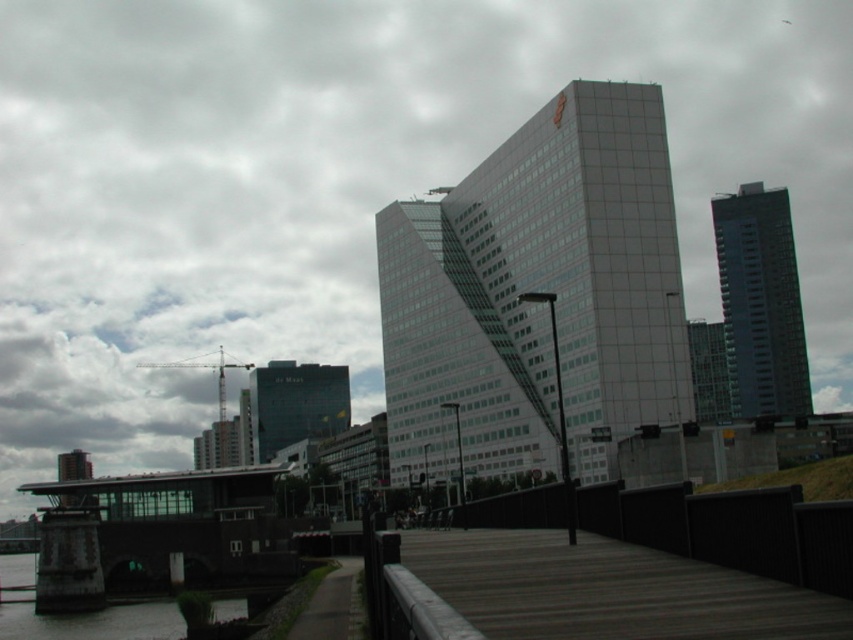
Question: Which point is farther from the camera taking this photo?

Choices:
 (A) [x=590, y=406]
 (B) [x=489, y=536]

Answer: (A)

Question: Can you confirm if wooden dock at center is positioned below dark glass building at upper right?

Choices:
 (A) no
 (B) yes

Answer: (B)

Question: Which point appears closest to the camera in this image?

Choices:
 (A) (544, 566)
 (B) (408, 365)
 (C) (343, 605)

Answer: (A)

Question: Which of the following is the closest to the observer?

Choices:
 (A) dark glass building at center
 (B) dark gray asphalt path at lower left
 (C) glassy gray skyscraper at center
 (D) dark glass building at upper right

Answer: (B)

Question: Can you confirm if glassy gray skyscraper at center is positioned to the left of dark glass building at upper right?

Choices:
 (A) yes
 (B) no

Answer: (A)

Question: In this image, where is glassy gray skyscraper at center located relative to wooden dock at center?

Choices:
 (A) below
 (B) above

Answer: (B)